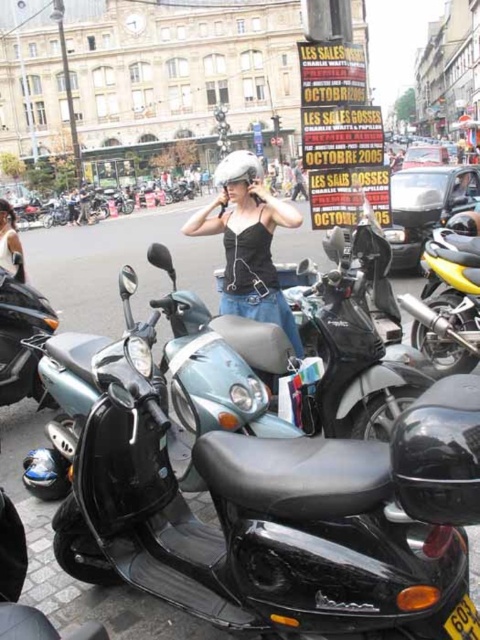
Question: Can you confirm if yellow metallic motorcycle at right is positioned to the left of shiny black scooter at lower left?

Choices:
 (A) yes
 (B) no

Answer: (B)

Question: Which point appears closest to the camera in this image?

Choices:
 (A) (451, 289)
 (B) (278, 212)

Answer: (A)

Question: Can you confirm if black matte tank top at center is thinner than shiny black scooter at lower left?

Choices:
 (A) no
 (B) yes

Answer: (A)

Question: Which of the following is the farthest from the observer?

Choices:
 (A) yellow metallic motorcycle at right
 (B) black matte tank top at center
 (C) white matte helmet at upper center
 (D) shiny black scooter at lower left

Answer: (C)

Question: Which object is the farthest from the white matte helmet at upper center?

Choices:
 (A) black matte tank top at center
 (B) shiny black scooter at lower left
 (C) yellow metallic motorcycle at right

Answer: (C)

Question: Does black matte tank top at center have a lesser width compared to shiny black scooter at lower left?

Choices:
 (A) yes
 (B) no

Answer: (B)